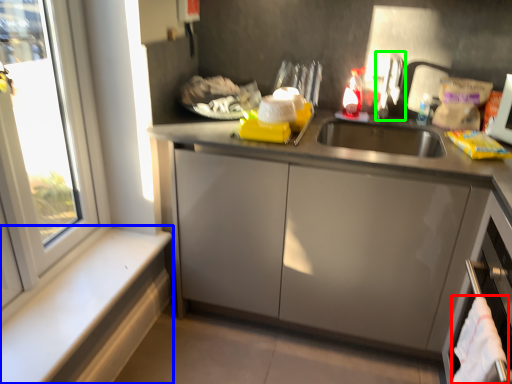
Question: Based on their relative distances, which object is farther from laundry (highlighted by a red box)? Choose from window sill (highlighted by a blue box) and faucet (highlighted by a green box).

Choices:
 (A) window sill
 (B) faucet

Answer: (A)